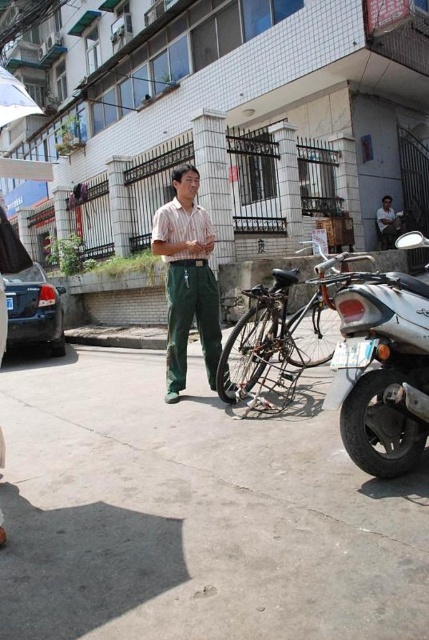
Question: Is striped fabric shirt at center behind matte green pants at center?

Choices:
 (A) yes
 (B) no

Answer: (B)

Question: Can you confirm if silver metallic motorcycle at lower right is positioned to the left of matte green pants at center?

Choices:
 (A) no
 (B) yes

Answer: (B)

Question: Which point is farther to the camera?

Choices:
 (A) matte green pants at center
 (B) silver metallic motorcycle at lower right

Answer: (A)

Question: Which object is positioned closest to the gray concrete pavement at center?

Choices:
 (A) striped fabric shirt at center
 (B) white fabric umbrella at upper left
 (C) silver metallic motorcycle at lower right
 (D) matte green pants at center

Answer: (C)

Question: Can you confirm if silver metallic motorcycle at lower right is thinner than matte green pants at center?

Choices:
 (A) no
 (B) yes

Answer: (A)

Question: Which point is closer to the camera?

Choices:
 (A) silver metallic motorcycle at lower right
 (B) gray concrete pavement at center
 (C) white fabric umbrella at upper left

Answer: (B)